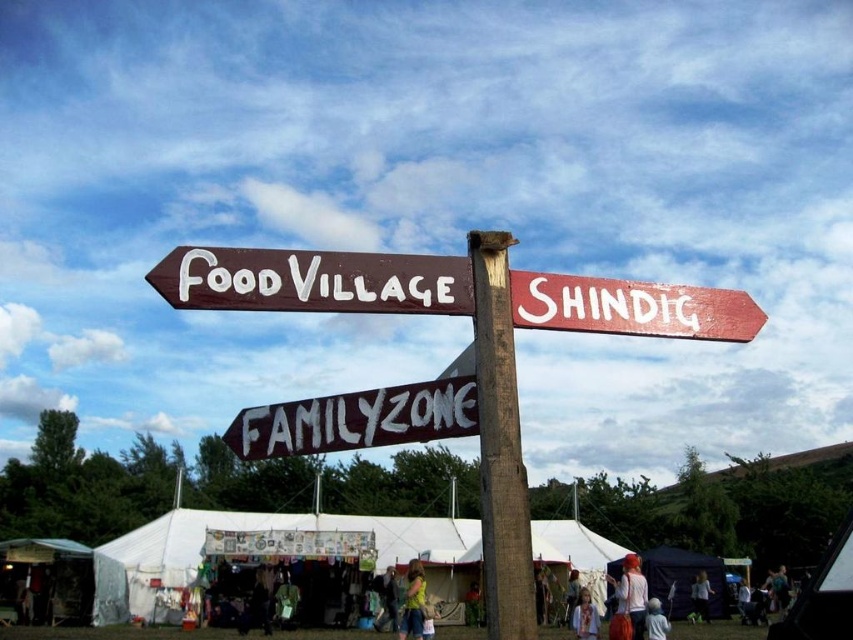
From the picture: You are holding a camera and want to take a photo of the white painted wood sign at center. If you are standing 3.90 meters away from the sign, is that the recommended distance for a clear photo?

The white painted wood sign at center and camera are 3.90 meters apart from each other. The recommended distance for a clear photo is typically around 2 to 3 meters, so you might want to move closer to ensure clarity.

You are at the festival and need to locate the white canvas tent at lower center. Which direction should you move relative to the brown wooden signpost at center?

The brown wooden signpost at center is to the right of the white canvas tent at lower center, so you should move to the left of the brown wooden signpost at center to find the white canvas tent at lower center.

You are standing at the festival and see the brown wooden signpost at center and the white fabric person at lower center. Which object is closer to you?

→ The brown wooden signpost at center is closer to you because it is in front of the white fabric person at lower center.